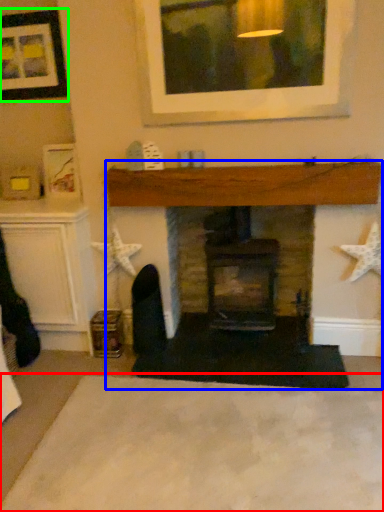
Question: Which object is the closest to the plain (highlighted by a red box)? Choose among these: fireplace (highlighted by a blue box) or picture frame (highlighted by a green box).

Choices:
 (A) fireplace
 (B) picture frame

Answer: (A)